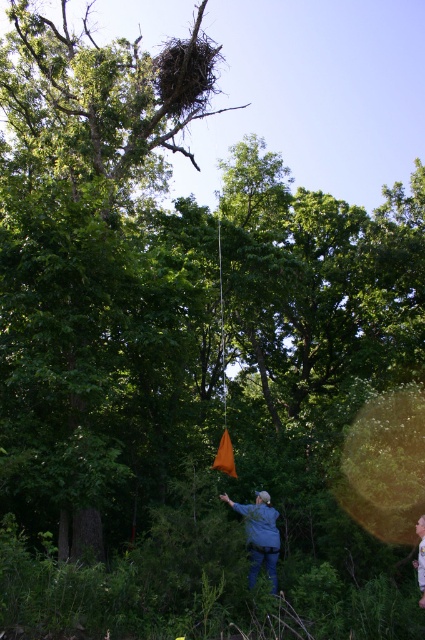
Question: Is green leafy tree at upper center above blue denim jeans at lower center?

Choices:
 (A) yes
 (B) no

Answer: (A)

Question: Estimate the real-world distances between objects in this image. Which object is farther from the blue denim jacket at center?

Choices:
 (A) green leafy tree at upper center
 (B) blue denim jeans at lower center

Answer: (A)

Question: Is green leafy tree at upper center positioned in front of blue denim jeans at lower center?

Choices:
 (A) yes
 (B) no

Answer: (B)

Question: Which of the following is the closest to the observer?

Choices:
 (A) (116, 342)
 (B) (272, 536)
 (C) (422, 593)

Answer: (C)

Question: Which object appears farthest from the camera in this image?

Choices:
 (A) blue denim jeans at lower center
 (B) green leafy tree at upper center
 (C) blue denim jacket at center

Answer: (C)

Question: Does green leafy tree at upper center have a lesser width compared to blue denim jeans at lower center?

Choices:
 (A) yes
 (B) no

Answer: (B)